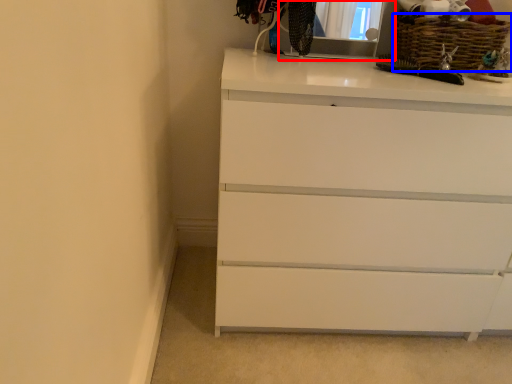
Question: Which object appears farthest to the camera in this image, medicine cabinet (highlighted by a red box) or basket (highlighted by a blue box)?

Choices:
 (A) medicine cabinet
 (B) basket

Answer: (B)